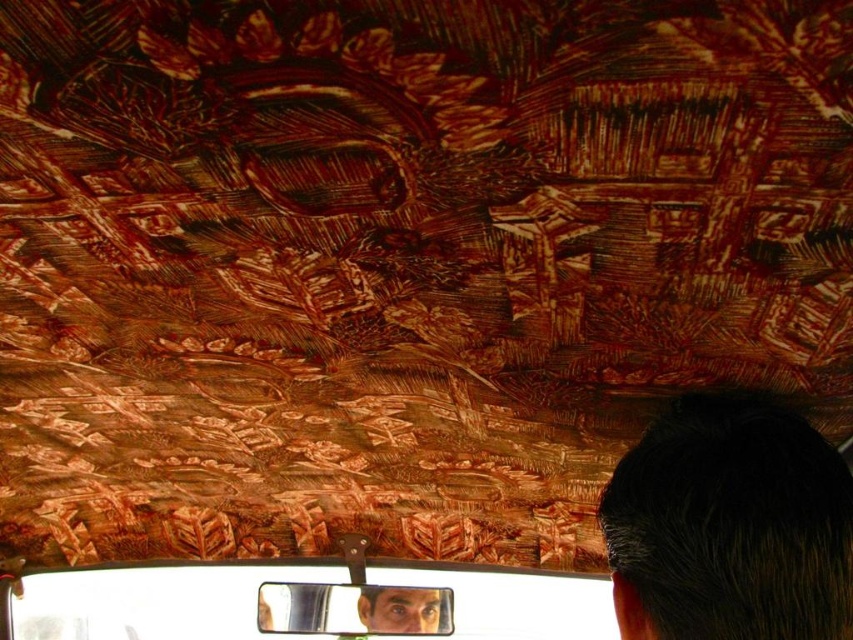
Question: Does dark brown hair at upper right have a greater width compared to metallic reflective mirror at center?

Choices:
 (A) no
 (B) yes

Answer: (A)

Question: Which point is closer to the camera taking this photo?

Choices:
 (A) (648, 579)
 (B) (355, 586)

Answer: (A)

Question: Which point appears farthest from the camera in this image?

Choices:
 (A) pyautogui.click(x=347, y=608)
 (B) pyautogui.click(x=723, y=608)

Answer: (A)

Question: Where is dark brown hair at upper right located in relation to metallic reflective mirror at center in the image?

Choices:
 (A) above
 (B) below

Answer: (A)

Question: Which point is farther to the camera?

Choices:
 (A) (263, 588)
 (B) (772, 460)

Answer: (A)

Question: Does dark brown hair at upper right appear on the left side of metallic reflective mirror at center?

Choices:
 (A) no
 (B) yes

Answer: (A)